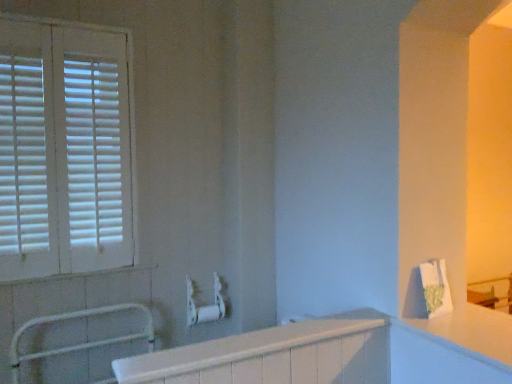
Question: Can you confirm if white wooden blinds at left is shorter than white matte metal balustrade at lower left?

Choices:
 (A) yes
 (B) no

Answer: (B)

Question: Is white wooden blinds at left oriented away from white matte metal balustrade at lower left?

Choices:
 (A) no
 (B) yes

Answer: (A)

Question: Considering the relative positions of white wooden blinds at left and white matte metal balustrade at lower left in the image provided, is white wooden blinds at left behind white matte metal balustrade at lower left?

Choices:
 (A) yes
 (B) no

Answer: (A)

Question: Is white wooden blinds at left to the right of white matte metal balustrade at lower left from the viewer's perspective?

Choices:
 (A) no
 (B) yes

Answer: (A)

Question: Can you confirm if white wooden blinds at left is wider than white matte metal balustrade at lower left?

Choices:
 (A) yes
 (B) no

Answer: (B)

Question: Is white wooden blinds at left wider or thinner than white glossy countertop at right?

Choices:
 (A) wide
 (B) thin

Answer: (B)

Question: Is point (96, 64) closer or farther from the camera than point (497, 336)?

Choices:
 (A) farther
 (B) closer

Answer: (A)

Question: Is white wooden blinds at left situated inside white glossy countertop at right or outside?

Choices:
 (A) inside
 (B) outside

Answer: (B)

Question: Based on their sizes in the image, would you say white wooden blinds at left is bigger or smaller than white glossy countertop at right?

Choices:
 (A) small
 (B) big

Answer: (B)

Question: Considering the positions of white glossy countertop at right and white matte metal balustrade at lower left in the image, is white glossy countertop at right wider or thinner than white matte metal balustrade at lower left?

Choices:
 (A) thin
 (B) wide

Answer: (B)

Question: From the image's perspective, relative to white matte metal balustrade at lower left, is white glossy countertop at right above or below?

Choices:
 (A) below
 (B) above

Answer: (B)

Question: Visually, is white glossy countertop at right positioned to the left or to the right of white matte metal balustrade at lower left?

Choices:
 (A) left
 (B) right

Answer: (B)

Question: Is point (483, 355) positioned closer to the camera than point (150, 311)?

Choices:
 (A) closer
 (B) farther

Answer: (A)

Question: From a real-world perspective, is white plastic towel bar at center above or below white matte metal balustrade at lower left?

Choices:
 (A) above
 (B) below

Answer: (A)

Question: Is white plastic towel bar at center in front of or behind white matte metal balustrade at lower left in the image?

Choices:
 (A) behind
 (B) front

Answer: (A)